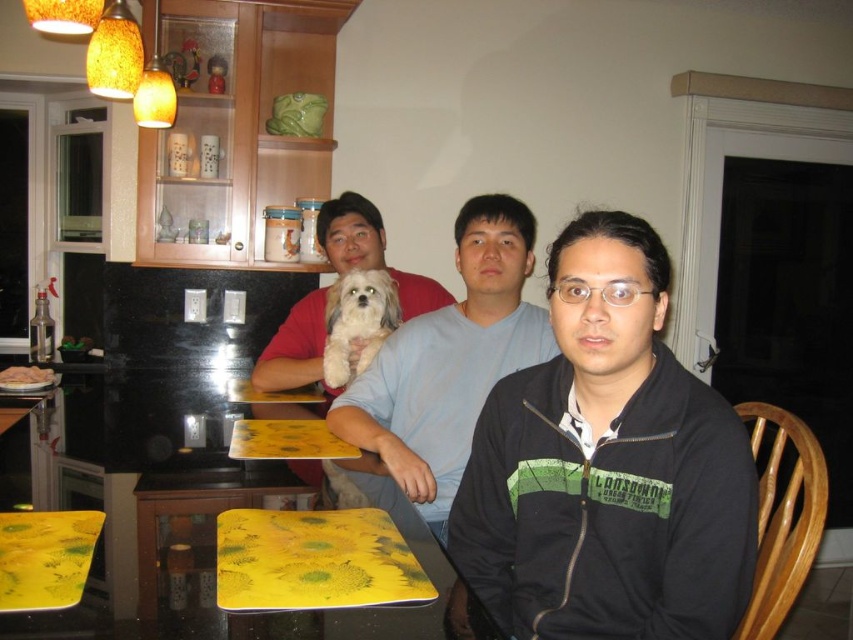
Between white fluffy dog at center and brown crumbly bread at lower left, which one is positioned higher?

Positioned higher is white fluffy dog at center.

Does point (393, 323) come farther from viewer compared to point (16, 374)?

No, (393, 323) is in front of (16, 374).

This screenshot has height=640, width=853. Describe the element at coordinates (357, 321) in the screenshot. I see `white fluffy dog at center` at that location.

You are a GUI agent. You are given a task and a screenshot of the screen. Output one action in this format:
    pyautogui.click(x=<x>, y=<y>)
    Task: Click on the white fluffy dog at center
    This screenshot has width=853, height=640.
    Given the screenshot: What is the action you would take?
    pyautogui.click(x=357, y=321)

Which of these two, fluffy white dog at center or brown crumbly bread at lower left, stands taller?

With more height is fluffy white dog at center.

Measure the distance between fluffy white dog at center and brown crumbly bread at lower left.

35.18 inches

Does point (257, 371) come closer to viewer compared to point (38, 387)?

Yes, it is.

Find the location of a particular element. The image size is (853, 640). fluffy white dog at center is located at coordinates (370, 252).

Is light blue cotton shirt at center above fluffy white dog at center?

Incorrect, light blue cotton shirt at center is not positioned above fluffy white dog at center.

Is light blue cotton shirt at center bigger than fluffy white dog at center?

Indeed, light blue cotton shirt at center has a larger size compared to fluffy white dog at center.

Is point (524, 204) farther from viewer compared to point (322, 221)?

No, it is not.

Locate an element on the screen. Image resolution: width=853 pixels, height=640 pixels. light blue cotton shirt at center is located at coordinates (447, 369).